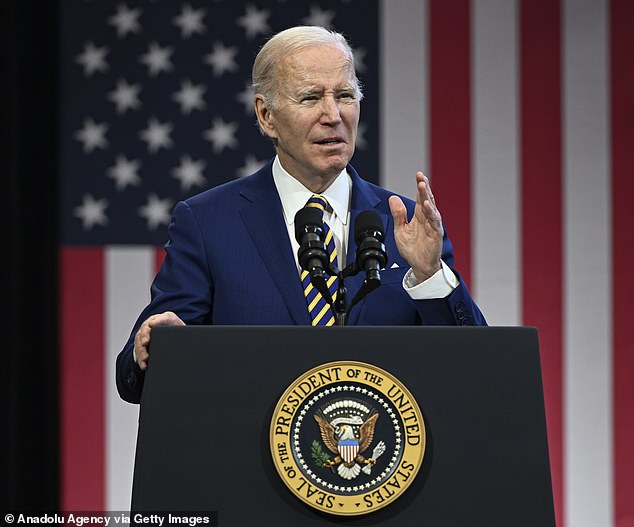
Image resolution: width=634 pixels, height=527 pixels. Find the location of `1 podium`. 1 podium is located at coordinates (501, 387).